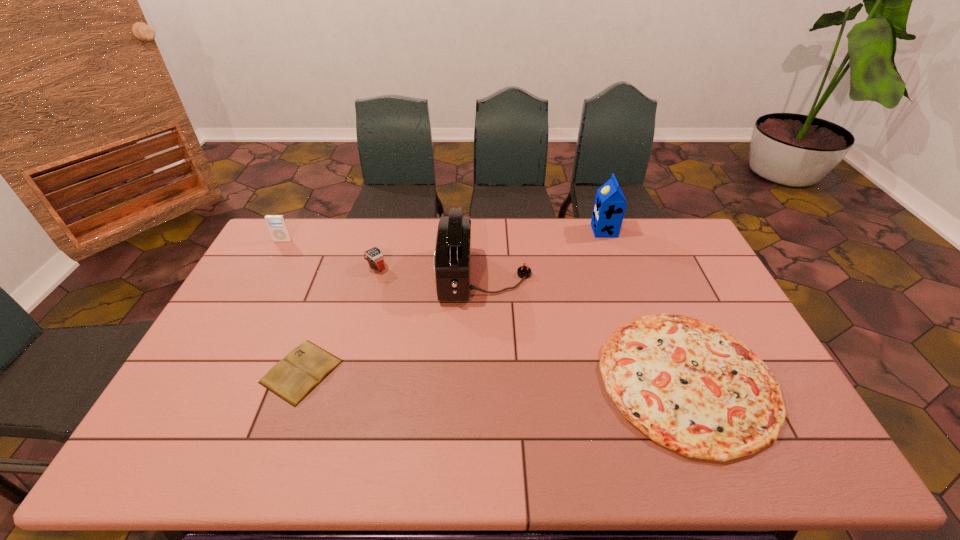
Find the location of a particular element. Image resolution: width=960 pixels, height=540 pixels. carton is located at coordinates (610, 204).

Where is `radio receiver`? The height and width of the screenshot is (540, 960). radio receiver is located at coordinates (452, 256).

The width and height of the screenshot is (960, 540). What are the coordinates of `the fifth nearest object` in the screenshot? It's located at (277, 225).

At what (x,y) coordinates should I click in order to perform the action: click on iPod. Please return your answer as a coordinate pair (x, y). The image size is (960, 540). Looking at the image, I should click on (277, 225).

Where is `watch`? watch is located at coordinates (374, 256).

The width and height of the screenshot is (960, 540). What are the coordinates of `pizza` in the screenshot? It's located at (688, 385).

Where is `the shortest object`? This screenshot has width=960, height=540. the shortest object is located at coordinates (294, 377).

Where is `free space located with the cap open on the carton`? free space located with the cap open on the carton is located at coordinates (566, 231).

Locate an element on the screen. This screenshot has width=960, height=540. free spot located 0.210m with the cap open on the carton is located at coordinates (538, 231).

The width and height of the screenshot is (960, 540). I want to click on free location located 0.330m with the cap open on the carton, so click(x=507, y=231).